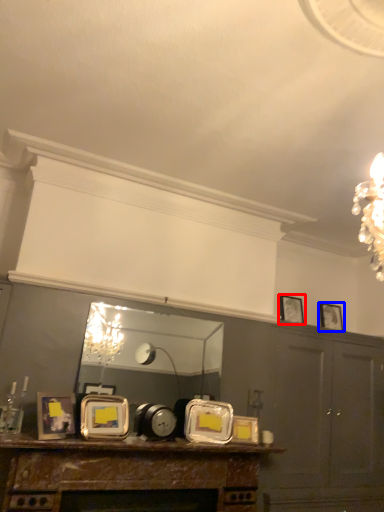
Question: Which of the following is the closest to the observer, picture frame (highlighted by a red box) or picture frame (highlighted by a blue box)?

Choices:
 (A) picture frame
 (B) picture frame

Answer: (A)